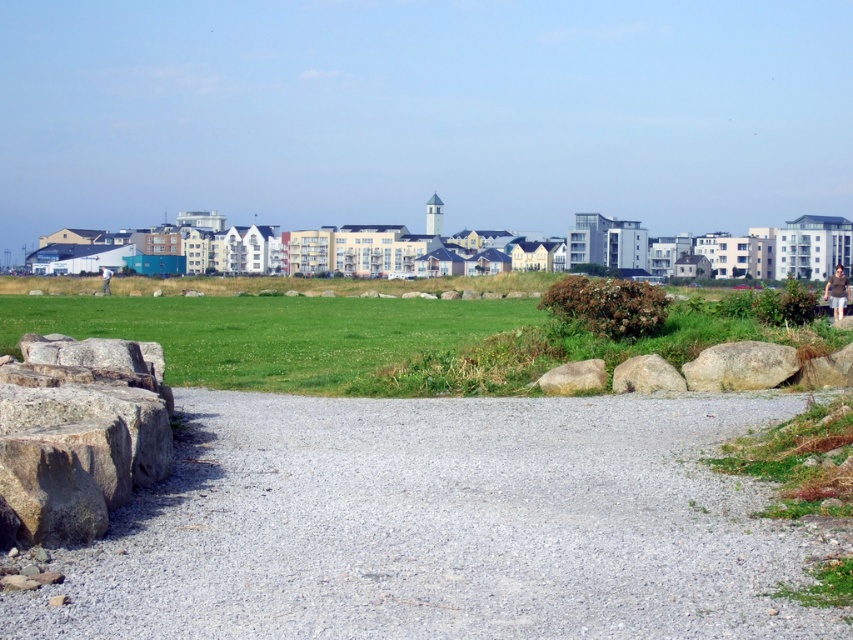
In the scene shown: You are a landscape architect designing a walking path. You want to place a bench between the brown rough boulder at center and the smooth gray rock at right. Based on their positions, where should the bench be placed to ensure it is between both objects?

The bench should be placed in front of the smooth gray rock at right and behind the brown rough boulder at center since the smooth gray rock at right is positioned behind the brown rough boulder at center.

You are standing on the gravel pathway and want to walk towards the green grass at lower center. Which direction should you move relative to the brown rough stone at lower left?

You should move towards the upper direction relative to the brown rough stone at lower left because the green grass at lower center is above it.